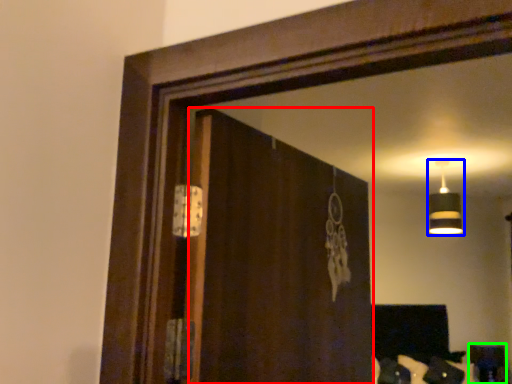
Question: Estimate the real-world distances between objects in this image. Which object is closer to screen door (highlighted by a red box), lamp (highlighted by a blue box) or furniture (highlighted by a green box)?

Choices:
 (A) lamp
 (B) furniture

Answer: (A)